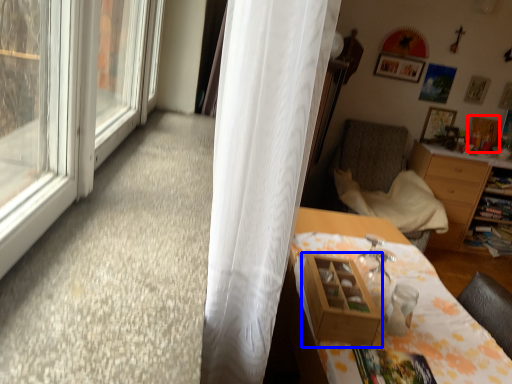
Question: Among these objects, which one is farthest to the camera, picture frame (highlighted by a red box) or shelf (highlighted by a blue box)?

Choices:
 (A) picture frame
 (B) shelf

Answer: (A)